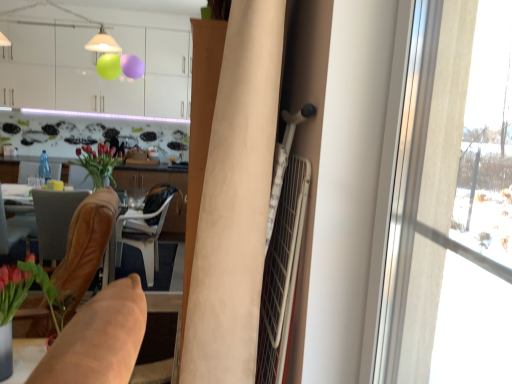
What do you see at coordinates (448, 202) in the screenshot? I see `transparent glass window at right` at bounding box center [448, 202].

The height and width of the screenshot is (384, 512). Describe the element at coordinates (14, 229) in the screenshot. I see `brown leather chair at lower left, which is the second chair from back to front` at that location.

How much space does brown leather chair at lower left, arranged as the second chair when viewed from the front, occupy horizontally?

It is 24.82 inches.

What is the approximate width of beige fabric curtain at center?

beige fabric curtain at center is 14.09 inches in width.

Image resolution: width=512 pixels, height=384 pixels. I want to click on white plastic chair at center, which ranks as the 3th chair in front-to-back order, so click(x=144, y=231).

Could you measure the distance between brown leather chair at lower left, arranged as the second chair when viewed from the front, and matte brown vase at center?

brown leather chair at lower left, arranged as the second chair when viewed from the front, and matte brown vase at center are 31.06 inches apart.

Is brown leather chair at lower left, which is the second chair from back to front, not inside matte brown vase at center?

brown leather chair at lower left, which is the second chair from back to front, lies outside matte brown vase at center's area.

From the picture: Is brown leather chair at lower left, which is the second chair from back to front, oriented towards matte brown vase at center?

No, brown leather chair at lower left, which is the second chair from back to front, does not turn towards matte brown vase at center.

Based on the photo, is brown leather chair at lower left, which is the second chair from back to front, wider than matte brown vase at center?

Yes, brown leather chair at lower left, which is the second chair from back to front, is wider than matte brown vase at center.

Would you consider white glossy cabinets at upper center to be distant from matte brown vase at center?

Yes, white glossy cabinets at upper center and matte brown vase at center are located far from each other.

This screenshot has width=512, height=384. What are the coordinates of `cabinetry above the matte brown vase at center (from the image's perspective)` in the screenshot? It's located at (95, 71).

Between white glossy cabinets at upper center and matte brown vase at center, which one has less height?

matte brown vase at center is shorter.

Considering the sizes of objects white glossy cabinets at upper center and matte brown vase at center in the image provided, who is smaller, white glossy cabinets at upper center or matte brown vase at center?

matte brown vase at center is smaller.

Is white plastic chair at center, which appears as the first chair when viewed from the back, situated inside brown leather chair at lower left, arranged as the second chair when viewed from the front, or outside?

white plastic chair at center, which appears as the first chair when viewed from the back, cannot be found inside brown leather chair at lower left, arranged as the second chair when viewed from the front.

Considering the sizes of white plastic chair at center, which appears as the first chair when viewed from the back, and brown leather chair at lower left, which is the second chair from back to front, in the image, is white plastic chair at center, which appears as the first chair when viewed from the back, bigger or smaller than brown leather chair at lower left, which is the second chair from back to front,?

white plastic chair at center, which appears as the first chair when viewed from the back, is bigger than brown leather chair at lower left, which is the second chair from back to front.

Looking at this image, is brown leather chair at lower left, arranged as the second chair when viewed from the front, at the back of white plastic chair at center, which appears as the first chair when viewed from the back?

No, brown leather chair at lower left, arranged as the second chair when viewed from the front, is not at the back of white plastic chair at center, which appears as the first chair when viewed from the back.

Does brown leather chair at lower left, which is the second chair from back to front, appear on the left side of transparent glass bottle at center?

Indeed, brown leather chair at lower left, which is the second chair from back to front, is positioned on the left side of transparent glass bottle at center.

Can we say brown leather chair at lower left, arranged as the second chair when viewed from the front, lies outside transparent glass bottle at center?

Yes, brown leather chair at lower left, arranged as the second chair when viewed from the front, is outside of transparent glass bottle at center.

Is brown leather chair at lower left, arranged as the second chair when viewed from the front, with transparent glass bottle at center?

They are not placed beside each other.

From a real-world perspective, is brown leather chair at lower left, arranged as the second chair when viewed from the front, positioned under green glossy vase at lower left based on gravity?

Indeed, from a real-world perspective, brown leather chair at lower left, arranged as the second chair when viewed from the front, is positioned beneath green glossy vase at lower left.

From the picture: From the image's perspective, is brown leather chair at lower left, arranged as the second chair when viewed from the front, below green glossy vase at lower left?

No, from the image's perspective, brown leather chair at lower left, arranged as the second chair when viewed from the front, is not below green glossy vase at lower left.

Starting from the green glossy vase at lower left, which chair is the 2nd one behind? Please provide its 2D coordinates.

[(14, 229)]

Looking at this image, is brown leather chair at lower left, arranged as the second chair when viewed from the front, taller or shorter than green glossy vase at lower left?

In the image, brown leather chair at lower left, arranged as the second chair when viewed from the front, appears to be taller than green glossy vase at lower left.

Which of these two, transparent glass bottle at center or brown leather chair at left, marked as the 1th chair in a front-to-back arrangement, stands shorter?

With less height is transparent glass bottle at center.

Does transparent glass bottle at center have a smaller size compared to brown leather chair at left, marked as the 1th chair in a front-to-back arrangement?

Yes.

Which object is more forward, transparent glass bottle at center or brown leather chair at left, marked as the 1th chair in a front-to-back arrangement?

brown leather chair at left, marked as the 1th chair in a front-to-back arrangement, is more forward.

From the picture: Is transparent glass bottle at center far away from brown leather chair at left, marked as the 1th chair in a front-to-back arrangement?

Yes, transparent glass bottle at center and brown leather chair at left, marked as the 1th chair in a front-to-back arrangement, are quite far apart.

Is white plastic chair at center, which ranks as the 3th chair in front-to-back order, situated inside brown leather chair at left, marked as the 1th chair in a front-to-back arrangement, or outside?

white plastic chair at center, which ranks as the 3th chair in front-to-back order, is spatially situated outside brown leather chair at left, marked as the 1th chair in a front-to-back arrangement.

Who is smaller, white plastic chair at center, which appears as the first chair when viewed from the back, or brown leather chair at left, which is the third chair in back-to-front order?

brown leather chair at left, which is the third chair in back-to-front order.

Is white plastic chair at center, which ranks as the 3th chair in front-to-back order, in contact with brown leather chair at left, which is the third chair in back-to-front order?

No, white plastic chair at center, which ranks as the 3th chair in front-to-back order, is not touching brown leather chair at left, which is the third chair in back-to-front order.

Where is `chair on the left of matte brown vase at center`? The height and width of the screenshot is (384, 512). chair on the left of matte brown vase at center is located at coordinates (14, 229).

You are a GUI agent. You are given a task and a screenshot of the screen. Output one action in this format:
    pyautogui.click(x=<x>, y=<y>)
    Task: Click on the floral arrangement below the white glossy cabinets at upper center (from the image's perspective)
    This screenshot has width=512, height=384.
    Given the screenshot: What is the action you would take?
    pyautogui.click(x=97, y=164)

Estimate the real-world distances between objects in this image. Which object is closer to transparent glass bottle at center, white glossy cabinets at upper center or matte brown vase at center?

matte brown vase at center is positioned closer to the anchor transparent glass bottle at center.

When comparing their distances from white plastic chair at center, which appears as the first chair when viewed from the back, does green glossy vase at lower left or white glossy cabinets at upper center seem further?

Among the two, white glossy cabinets at upper center is located further to white plastic chair at center, which appears as the first chair when viewed from the back.

Estimate the real-world distances between objects in this image. Which object is further from beige fabric curtain at center, white glossy cabinets at upper center or transparent glass window at right?

white glossy cabinets at upper center lies further to beige fabric curtain at center than the other object.

Considering their positions, is white plastic chair at center, which ranks as the 3th chair in front-to-back order, positioned closer to brown leather chair at lower left, which is the second chair from back to front, than green glossy vase at lower left?

The object closer to brown leather chair at lower left, which is the second chair from back to front, is white plastic chair at center, which ranks as the 3th chair in front-to-back order.

Looking at the image, which one is located further to beige fabric curtain at center, transparent glass window at right or green glossy vase at lower left?

green glossy vase at lower left is further to beige fabric curtain at center.

Estimate the real-world distances between objects in this image. Which object is further from transparent glass bottle at center, matte brown vase at center or green glossy vase at lower left?

The object further to transparent glass bottle at center is green glossy vase at lower left.

When comparing their distances from brown leather chair at left, marked as the 1th chair in a front-to-back arrangement, does beige fabric curtain at center or matte brown vase at center seem further?

matte brown vase at center.

Which object lies nearer to the anchor point green glossy vase at lower left, white glossy cabinets at upper center or beige fabric curtain at center?

The object closer to green glossy vase at lower left is beige fabric curtain at center.

The image size is (512, 384). Find the location of `houseplant positioned between transparent glass window at right and transparent glass bottle at center from near to far`. houseplant positioned between transparent glass window at right and transparent glass bottle at center from near to far is located at coordinates [x=23, y=300].

Identify the location of floral arrangement between brown leather chair at left, marked as the 1th chair in a front-to-back arrangement, and white plastic chair at center, which appears as the first chair when viewed from the back, from front to back. The height and width of the screenshot is (384, 512). (97, 164).

Where is `floral arrangement between transparent glass window at right and white glossy cabinets at upper center along the z-axis`? floral arrangement between transparent glass window at right and white glossy cabinets at upper center along the z-axis is located at coordinates 97,164.

This screenshot has height=384, width=512. I want to click on floral arrangement between white glossy cabinets at upper center and white plastic chair at center, which appears as the first chair when viewed from the back, from top to bottom, so click(x=97, y=164).